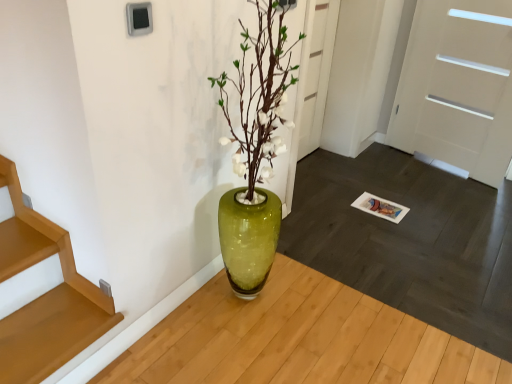
Describe the element at coordinates (457, 87) in the screenshot. I see `white glossy door at right, the first door positioned from the right` at that location.

This screenshot has height=384, width=512. I want to click on white glossy door at right, the first door positioned from the right, so click(457, 87).

This screenshot has width=512, height=384. What do you see at coordinates (316, 81) in the screenshot?
I see `white matte door at center, positioned as the 1th door in left-to-right order` at bounding box center [316, 81].

This screenshot has height=384, width=512. In order to click on white matte door at center, the 2th door when ordered from right to left in this screenshot , I will do `click(316, 81)`.

Where is `white glossy door at right, which is the second door from left to right`? white glossy door at right, which is the second door from left to right is located at coordinates (457, 87).

Based on the photo, which is more to the left, white matte door at center, the 2th door when ordered from right to left, or white glossy door at right, the first door positioned from the right?

white matte door at center, the 2th door when ordered from right to left, is more to the left.

Considering the positions of objects white matte door at center, positioned as the 1th door in left-to-right order, and white glossy door at right, which is the second door from left to right, in the image provided, who is in front, white matte door at center, positioned as the 1th door in left-to-right order, or white glossy door at right, which is the second door from left to right,?

Positioned in front is white glossy door at right, which is the second door from left to right.

Does point (320, 89) lie behind point (475, 15)?

Yes, it is behind point (475, 15).

From the image's perspective, is white matte door at center, positioned as the 1th door in left-to-right order, under white glossy door at right, the first door positioned from the right?

No, from the image's perspective, white matte door at center, positioned as the 1th door in left-to-right order, is not below white glossy door at right, the first door positioned from the right.

From a real-world perspective, is white matte door at center, positioned as the 1th door in left-to-right order, physically located above or below white glossy door at right, which is the second door from left to right?

Clearly, from a real-world perspective, white matte door at center, positioned as the 1th door in left-to-right order, is below white glossy door at right, which is the second door from left to right.

Is white matte door at center, positioned as the 1th door in left-to-right order, wider than white glossy door at right, which is the second door from left to right?

Incorrect, the width of white matte door at center, positioned as the 1th door in left-to-right order, does not surpass that of white glossy door at right, which is the second door from left to right.

Considering the relative sizes of white matte door at center, positioned as the 1th door in left-to-right order, and white glossy door at right, which is the second door from left to right, in the image provided, is white matte door at center, positioned as the 1th door in left-to-right order, taller than white glossy door at right, which is the second door from left to right,?

No.

Between white matte door at center, the 2th door when ordered from right to left, and white glossy door at right, which is the second door from left to right, which one has larger size?

white glossy door at right, which is the second door from left to right, is bigger.

Which is correct: white matte door at center, the 2th door when ordered from right to left, is inside white glossy door at right, the first door positioned from the right, or outside of it?

white matte door at center, the 2th door when ordered from right to left, is not enclosed by white glossy door at right, the first door positioned from the right.

Is there a large distance between white matte door at center, the 2th door when ordered from right to left, and white glossy door at right, the first door positioned from the right?

That's not correct — white matte door at center, the 2th door when ordered from right to left, is a little close to white glossy door at right, the first door positioned from the right.

Is white matte door at center, the 2th door when ordered from right to left, oriented towards white glossy door at right, which is the second door from left to right?

No, white matte door at center, the 2th door when ordered from right to left, does not turn towards white glossy door at right, which is the second door from left to right.

Find the location of a particular element. The image size is (512, 384). door on the left of white glossy door at right, the first door positioned from the right is located at coordinates (316, 81).

Considering the relative positions of white glossy door at right, which is the second door from left to right, and white matte door at center, positioned as the 1th door in left-to-right order, in the image provided, is white glossy door at right, which is the second door from left to right, to the right of white matte door at center, positioned as the 1th door in left-to-right order, from the viewer's perspective?

Yes, white glossy door at right, which is the second door from left to right, is to the right of white matte door at center, positioned as the 1th door in left-to-right order.

Is white glossy door at right, the first door positioned from the right, further to the viewer compared to white matte door at center, the 2th door when ordered from right to left?

No, white glossy door at right, the first door positioned from the right, is closer to the viewer.

Considering the positions of points (413, 28) and (316, 15), is point (413, 28) closer to camera compared to point (316, 15)?

No, (413, 28) is further to viewer.

From the image's perspective, between white glossy door at right, the first door positioned from the right, and white matte door at center, positioned as the 1th door in left-to-right order, which one is located above?

white matte door at center, positioned as the 1th door in left-to-right order, appears higher in the image.

From a real-world perspective, relative to white matte door at center, positioned as the 1th door in left-to-right order, is white glossy door at right, the first door positioned from the right, vertically above or below?

From a real-world perspective, white glossy door at right, the first door positioned from the right, is physically above white matte door at center, positioned as the 1th door in left-to-right order.

Does white glossy door at right, which is the second door from left to right, have a greater width compared to white matte door at center, positioned as the 1th door in left-to-right order?

Indeed, white glossy door at right, which is the second door from left to right, has a greater width compared to white matte door at center, positioned as the 1th door in left-to-right order.

Does white glossy door at right, which is the second door from left to right, have a greater height compared to white matte door at center, the 2th door when ordered from right to left?

Yes.

Does white glossy door at right, the first door positioned from the right, have a smaller size compared to white matte door at center, the 2th door when ordered from right to left?

No.

Do you think white glossy door at right, the first door positioned from the right, is within white matte door at center, positioned as the 1th door in left-to-right order, or outside of it?

white glossy door at right, the first door positioned from the right, is spatially situated outside white matte door at center, positioned as the 1th door in left-to-right order.

Is white glossy door at right, which is the second door from left to right, touching white matte door at center, the 2th door when ordered from right to left?

No, white glossy door at right, which is the second door from left to right, is not touching white matte door at center, the 2th door when ordered from right to left.

Is white glossy door at right, which is the second door from left to right, oriented towards white matte door at center, positioned as the 1th door in left-to-right order?

Yes, white glossy door at right, which is the second door from left to right, is turned towards white matte door at center, positioned as the 1th door in left-to-right order.

At what (x,y) coordinates should I click in order to perform the action: click on door below the white matte door at center, the 2th door when ordered from right to left (from the image's perspective). Please return your answer as a coordinate pair (x, y). Looking at the image, I should click on (457, 87).

This screenshot has width=512, height=384. I want to click on door behind the white glossy door at right, which is the second door from left to right, so click(x=316, y=81).

Identify the location of door below the white glossy door at right, which is the second door from left to right (from a real-world perspective). (316, 81).